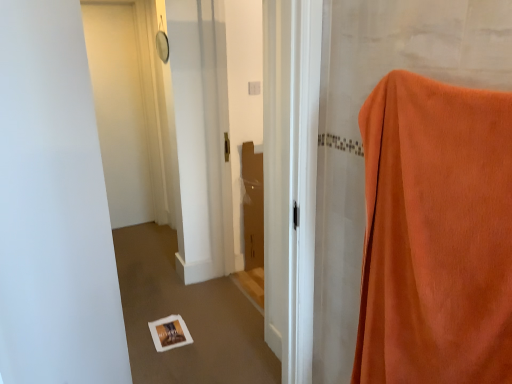
Image resolution: width=512 pixels, height=384 pixels. What do you see at coordinates (120, 110) in the screenshot? I see `white matte door at upper left` at bounding box center [120, 110].

Where is `white matte door at upper left`? This screenshot has width=512, height=384. white matte door at upper left is located at coordinates (120, 110).

This screenshot has width=512, height=384. Identify the location of orange velvety curtain at right. (436, 234).

Describe the element at coordinates (436, 234) in the screenshot. The image size is (512, 384). I see `orange velvety curtain at right` at that location.

You are a GUI agent. You are given a task and a screenshot of the screen. Output one action in this format:
    pyautogui.click(x=<x>, y=<y>)
    Task: Click on the white matte door at upper left
    This screenshot has height=384, width=512.
    Given the screenshot: What is the action you would take?
    pyautogui.click(x=120, y=110)

Considering the positions of objects white matte door at upper left and orange velvety curtain at right in the image provided, who is more to the right, white matte door at upper left or orange velvety curtain at right?

orange velvety curtain at right is more to the right.

Does white matte door at upper left come behind orange velvety curtain at right?

Yes, white matte door at upper left is further from the camera.

Which is more distant, (131, 96) or (395, 217)?

The point (131, 96) is farther from the camera.

From the image's perspective, is white matte door at upper left on top of orange velvety curtain at right?

Indeed, from the image's perspective, white matte door at upper left is shown above orange velvety curtain at right.

From a real-world perspective, between white matte door at upper left and orange velvety curtain at right, who is vertically higher?

white matte door at upper left.

Considering the relative sizes of white matte door at upper left and orange velvety curtain at right in the image provided, is white matte door at upper left wider than orange velvety curtain at right?

No, white matte door at upper left is not wider than orange velvety curtain at right.

Between white matte door at upper left and orange velvety curtain at right, which one has more height?

white matte door at upper left.

In terms of size, does white matte door at upper left appear bigger or smaller than orange velvety curtain at right?

Considering their sizes, white matte door at upper left takes up less space than orange velvety curtain at right.

Choose the correct answer: Is white matte door at upper left inside orange velvety curtain at right or outside it?

white matte door at upper left is located beyond the bounds of orange velvety curtain at right.

Is there a large distance between white matte door at upper left and orange velvety curtain at right?

Yes, white matte door at upper left is far from orange velvety curtain at right.

Is orange velvety curtain at right at the back of white matte door at upper left?

No, white matte door at upper left is not facing away from orange velvety curtain at right.

From the picture: How many degrees apart are the facing directions of white matte door at upper left and orange velvety curtain at right?

91.9 degrees separate the facing orientations of white matte door at upper left and orange velvety curtain at right.

Locate an element on the screen. This screenshot has width=512, height=384. curtain that appears below the white matte door at upper left (from a real-world perspective) is located at coordinates (436, 234).

From the picture: Is orange velvety curtain at right to the left of white matte door at upper left from the viewer's perspective?

Incorrect, orange velvety curtain at right is not on the left side of white matte door at upper left.

Which is behind, orange velvety curtain at right or white matte door at upper left?

white matte door at upper left is further from the camera.

Considering the positions of points (510, 228) and (121, 75), is point (510, 228) farther from camera compared to point (121, 75)?

No, it is in front of (121, 75).

From the image's perspective, does orange velvety curtain at right appear lower than white matte door at upper left?

Yes, from the image's perspective, orange velvety curtain at right is below white matte door at upper left.

From a real-world perspective, does orange velvety curtain at right stand above white matte door at upper left?

No.

Which of these two, orange velvety curtain at right or white matte door at upper left, is wider?

orange velvety curtain at right is wider.

Considering the relative sizes of orange velvety curtain at right and white matte door at upper left in the image provided, is orange velvety curtain at right taller than white matte door at upper left?

Incorrect, the height of orange velvety curtain at right is not larger of that of white matte door at upper left.

Is orange velvety curtain at right smaller than white matte door at upper left?

No.

In the scene shown: Could white matte door at upper left be considered to be inside orange velvety curtain at right?

No.

Is orange velvety curtain at right beside white matte door at upper left?

No.

Is orange velvety curtain at right facing away from white matte door at upper left?

No, orange velvety curtain at right is not facing the opposite direction of white matte door at upper left.

How far apart are orange velvety curtain at right and white matte door at upper left?

3.02 meters.

Locate an element on the screen. The height and width of the screenshot is (384, 512). curtain on the right side of white matte door at upper left is located at coordinates (436, 234).

Find the location of `curtain on the right of white matte door at upper left`. curtain on the right of white matte door at upper left is located at coordinates (436, 234).

Locate an element on the screen. The width and height of the screenshot is (512, 384). door behind the orange velvety curtain at right is located at coordinates (120, 110).